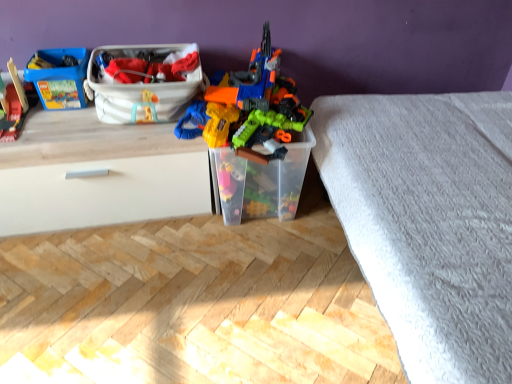
Question: Is wooden train at left, the 2th toy in the right-to-left sequence, next to white plastic storage box at upper center, which ranks as the 2th storage box in left-to-right order?

Choices:
 (A) yes
 (B) no

Answer: (B)

Question: Can we say wooden train at left, the 2th toy in the right-to-left sequence, lies outside white plastic storage box at upper center, which ranks as the 2th storage box in left-to-right order?

Choices:
 (A) no
 (B) yes

Answer: (B)

Question: Is wooden train at left, which is counted as the first toy, starting from the left, positioned before white plastic storage box at upper center, which ranks as the 2th storage box in left-to-right order?

Choices:
 (A) no
 (B) yes

Answer: (B)

Question: Are wooden train at left, which is counted as the first toy, starting from the left, and white plastic storage box at upper center, which ranks as the 2th storage box in left-to-right order, located far from each other?

Choices:
 (A) yes
 (B) no

Answer: (B)

Question: Does wooden train at left, the 2th toy in the right-to-left sequence, have a larger size compared to white plastic storage box at upper center, which ranks as the 2th storage box in left-to-right order?

Choices:
 (A) no
 (B) yes

Answer: (A)

Question: Could you tell me if wooden train at left, which is counted as the first toy, starting from the left, is facing white plastic storage box at upper center, marked as the 2th storage box in a right-to-left arrangement?

Choices:
 (A) no
 (B) yes

Answer: (A)

Question: Does transparent plastic container at center, positioned as the third storage box in left-to-right order, have a larger size compared to white matte drawer at left?

Choices:
 (A) no
 (B) yes

Answer: (A)

Question: Does transparent plastic container at center, which appears as the 1th storage box when viewed from the right, have a greater height compared to white matte drawer at left?

Choices:
 (A) no
 (B) yes

Answer: (A)

Question: From the image's perspective, is transparent plastic container at center, positioned as the third storage box in left-to-right order, located beneath white matte drawer at left?

Choices:
 (A) no
 (B) yes

Answer: (A)

Question: Is transparent plastic container at center, which appears as the 1th storage box when viewed from the right, touching white matte drawer at left?

Choices:
 (A) no
 (B) yes

Answer: (A)

Question: Does transparent plastic container at center, positioned as the third storage box in left-to-right order, have a lesser width compared to white matte drawer at left?

Choices:
 (A) no
 (B) yes

Answer: (A)

Question: Does transparent plastic container at center, positioned as the third storage box in left-to-right order, contain white matte drawer at left?

Choices:
 (A) yes
 (B) no

Answer: (B)

Question: From a real-world perspective, is wooden train at left, the 2th toy in the right-to-left sequence, on matte plastic lego box at upper left, placed as the 1th storage box when sorted from left to right?

Choices:
 (A) no
 (B) yes

Answer: (B)